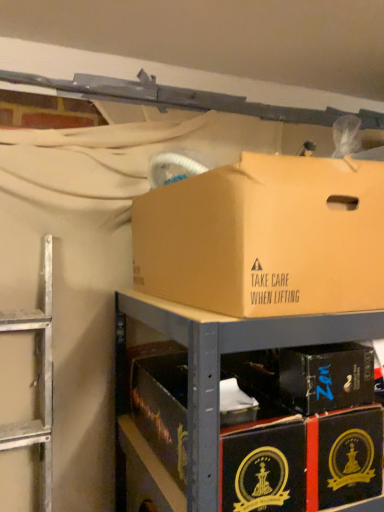
Find the location of a particular element. black cardboard boxes at lower right is located at coordinates (219, 364).

Where is `black cardboard boxes at lower right`? black cardboard boxes at lower right is located at coordinates (219, 364).

How far apart are black cardboard box at center, the second box viewed from the top, and brown cardboard box at upper center, marked as the 1th box in a top-to-bottom arrangement?

9.87 inches.

Between black cardboard box at center, the second box viewed from the top, and brown cardboard box at upper center, which is the second box from bottom to top, which one appears on the right side from the viewer's perspective?

black cardboard box at center, the second box viewed from the top.

The width and height of the screenshot is (384, 512). I want to click on box that is behind the brown cardboard box at upper center, which is the second box from bottom to top, so (x=326, y=377).

Would you consider black cardboard box at center, the second box viewed from the top, to be distant from brown cardboard box at upper center, marked as the 1th box in a top-to-bottom arrangement?

That's not correct — black cardboard box at center, the second box viewed from the top, is a little close to brown cardboard box at upper center, marked as the 1th box in a top-to-bottom arrangement.

How far apart are black cardboard boxes at lower right and brown cardboard box at upper center, which is the second box from bottom to top?

They are 5.01 inches apart.

In the scene shown: From a real-world perspective, is black cardboard boxes at lower right physically below brown cardboard box at upper center, marked as the 1th box in a top-to-bottom arrangement?

Yes, from a real-world perspective, black cardboard boxes at lower right is below brown cardboard box at upper center, marked as the 1th box in a top-to-bottom arrangement.

Does black cardboard boxes at lower right come behind brown cardboard box at upper center, which is the second box from bottom to top?

Yes, black cardboard boxes at lower right is further from the camera.

Is black cardboard boxes at lower right situated inside brown cardboard box at upper center, which is the second box from bottom to top, or outside?

The correct answer is: outside.

Which object is closer to the camera, black cardboard box at center, which is the 1th box from bottom to top, or black cardboard boxes at lower right?

black cardboard boxes at lower right is closer to the camera.

Locate an element on the screen. box on the right of black cardboard boxes at lower right is located at coordinates (326, 377).

Is point (368, 374) positioned before point (192, 501)?

No, it is behind (192, 501).

From the image's perspective, between brown cardboard box at upper center, which is the second box from bottom to top, and black cardboard boxes at lower right, which one is located above?

brown cardboard box at upper center, which is the second box from bottom to top, appears higher in the image.

Find the location of `shelf behind the brown cardboard box at upper center, which is the second box from bottom to top`. shelf behind the brown cardboard box at upper center, which is the second box from bottom to top is located at coordinates (219, 364).

Is brown cardboard box at upper center, marked as the 1th box in a top-to-bottom arrangement, aimed at black cardboard boxes at lower right?

No, brown cardboard box at upper center, marked as the 1th box in a top-to-bottom arrangement, is not aimed at black cardboard boxes at lower right.

Is there a large distance between brown cardboard box at upper center, marked as the 1th box in a top-to-bottom arrangement, and black cardboard boxes at lower right?

brown cardboard box at upper center, marked as the 1th box in a top-to-bottom arrangement, is near black cardboard boxes at lower right, not far away.

Based on the photo, how different are the orientations of brown cardboard box at upper center, which is the second box from bottom to top, and black cardboard box at center, which is the 1th box from bottom to top, in degrees?

1.49 degrees.

From a real-world perspective, is brown cardboard box at upper center, which is the second box from bottom to top, positioned above or below black cardboard box at center, which is the 1th box from bottom to top?

brown cardboard box at upper center, which is the second box from bottom to top, is above black cardboard box at center, which is the 1th box from bottom to top.

Could you tell me if brown cardboard box at upper center, marked as the 1th box in a top-to-bottom arrangement, is facing black cardboard box at center, the second box viewed from the top?

No, brown cardboard box at upper center, marked as the 1th box in a top-to-bottom arrangement, is not turned towards black cardboard box at center, the second box viewed from the top.

Looking at this image, considering their positions, is brown cardboard box at upper center, marked as the 1th box in a top-to-bottom arrangement, located in front of or behind black cardboard box at center, the second box viewed from the top?

In the image, brown cardboard box at upper center, marked as the 1th box in a top-to-bottom arrangement, appears in front of black cardboard box at center, the second box viewed from the top.

From the image's perspective, is black cardboard boxes at lower right above or below black cardboard box at center, the second box viewed from the top?

Clearly, from the image's perspective, black cardboard boxes at lower right is below black cardboard box at center, the second box viewed from the top.

Is black cardboard boxes at lower right surrounding black cardboard box at center, which is the 1th box from bottom to top?

No, black cardboard box at center, which is the 1th box from bottom to top, is not surrounded by black cardboard boxes at lower right.

Which object is further away from the camera taking this photo, black cardboard boxes at lower right or black cardboard box at center, which is the 1th box from bottom to top?

black cardboard box at center, which is the 1th box from bottom to top, is further from the camera.

The image size is (384, 512). In order to click on box located on the left of black cardboard box at center, the second box viewed from the top in this screenshot , I will do `click(265, 238)`.

There is a black cardboard boxes at lower right. Identify the location of the 2nd box above it (from the image's perspective). (265, 238).

Based on their spatial positions, is black cardboard box at center, the second box viewed from the top, or brown cardboard box at upper center, which is the second box from bottom to top, further from black cardboard boxes at lower right?

black cardboard box at center, the second box viewed from the top, lies further to black cardboard boxes at lower right than the other object.

Considering their positions, is black cardboard boxes at lower right positioned further to black cardboard box at center, the second box viewed from the top, than brown cardboard box at upper center, marked as the 1th box in a top-to-bottom arrangement?

brown cardboard box at upper center, marked as the 1th box in a top-to-bottom arrangement.

Based on their spatial positions, is brown cardboard box at upper center, which is the second box from bottom to top, or black cardboard box at center, which is the 1th box from bottom to top, further from black cardboard boxes at lower right?

Among the two, black cardboard box at center, which is the 1th box from bottom to top, is located further to black cardboard boxes at lower right.

Considering their positions, is black cardboard boxes at lower right positioned further to brown cardboard box at upper center, which is the second box from bottom to top, than black cardboard box at center, the second box viewed from the top?

Based on the image, black cardboard box at center, the second box viewed from the top, appears to be further to brown cardboard box at upper center, which is the second box from bottom to top.

Considering their positions, is brown cardboard box at upper center, which is the second box from bottom to top, positioned closer to black cardboard box at center, the second box viewed from the top, than black cardboard boxes at lower right?

black cardboard boxes at lower right is closer to black cardboard box at center, the second box viewed from the top.

Which object lies nearer to the anchor point brown cardboard box at upper center, marked as the 1th box in a top-to-bottom arrangement, black cardboard box at center, the second box viewed from the top, or black cardboard boxes at lower right?

black cardboard boxes at lower right lies closer to brown cardboard box at upper center, marked as the 1th box in a top-to-bottom arrangement, than the other object.

The height and width of the screenshot is (512, 384). I want to click on box between brown cardboard box at upper center, which is the second box from bottom to top, and black cardboard boxes at lower right vertically, so click(x=326, y=377).